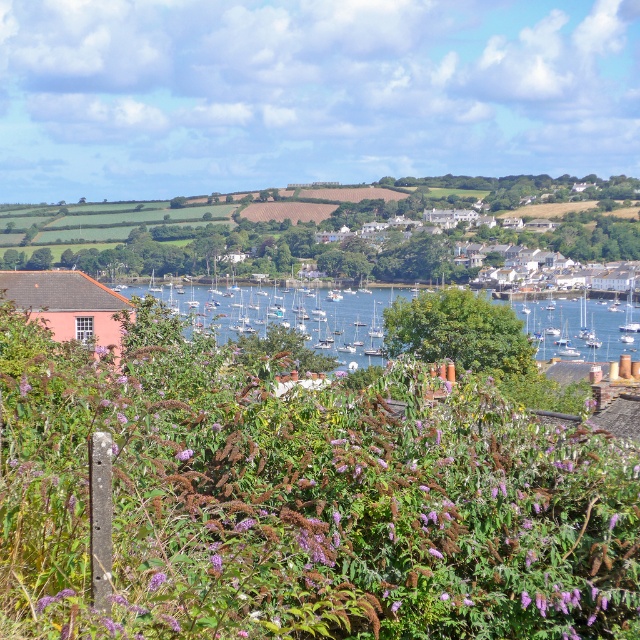
You are a tourist standing at the top of a hill overlooking the coastal town. You notice the purple fuzzy bush at center and the white glossy sailboat at center. Which object is closer to your left side?

The purple fuzzy bush at center is to the left of the white glossy sailboat at center, so it is closer to your left side.

You are a landscape architect planning to plant more bushes in the coastal town. You observe the purple fuzzy bush at center and the blue water at center. Which of these two has a smaller width?

The purple fuzzy bush at center is thinner than the blue water at center, so the purple fuzzy bush at center has a smaller width.

You are an artist planning to paint the coastal town scene. You want to ensure that the purple fuzzy bush at center and the blue water at center are proportionally accurate. Which object should you make smaller in your painting?

The purple fuzzy bush at center should be made smaller because it occupies less space than the blue water at center according to the description.